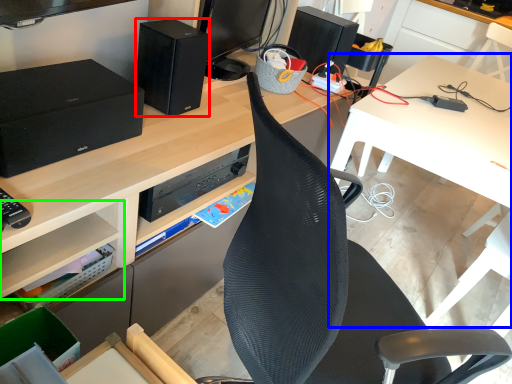
Question: Which is nearer to the speaker (highlighted by a red box)? table (highlighted by a blue box) or shelf (highlighted by a green box).

Choices:
 (A) table
 (B) shelf

Answer: (B)